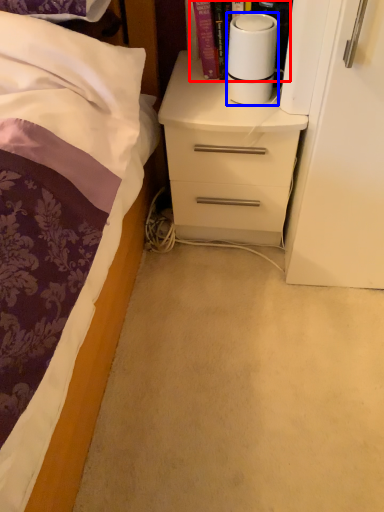
Question: Which of the following is the farthest to the observer, book (highlighted by a red box) or paper towel (highlighted by a blue box)?

Choices:
 (A) book
 (B) paper towel

Answer: (A)